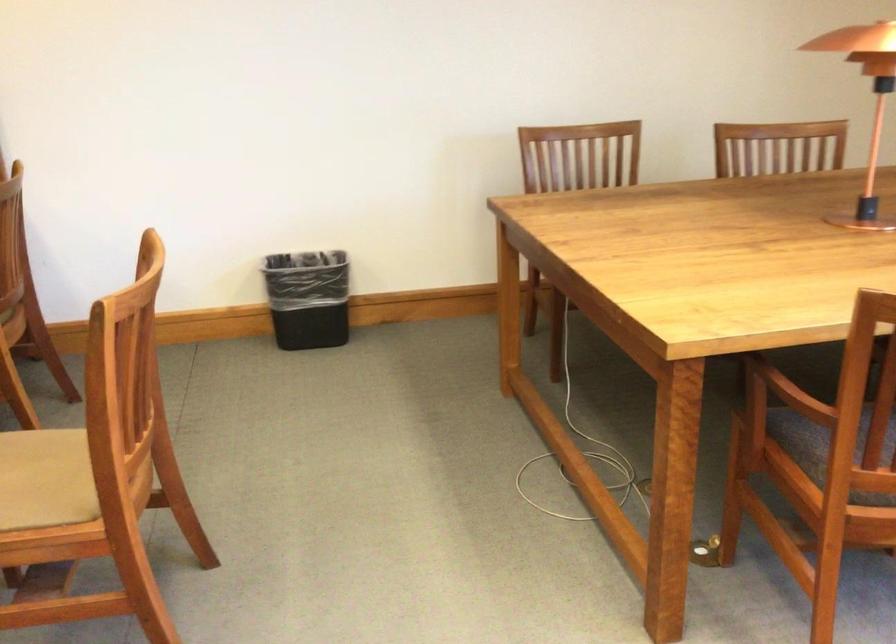
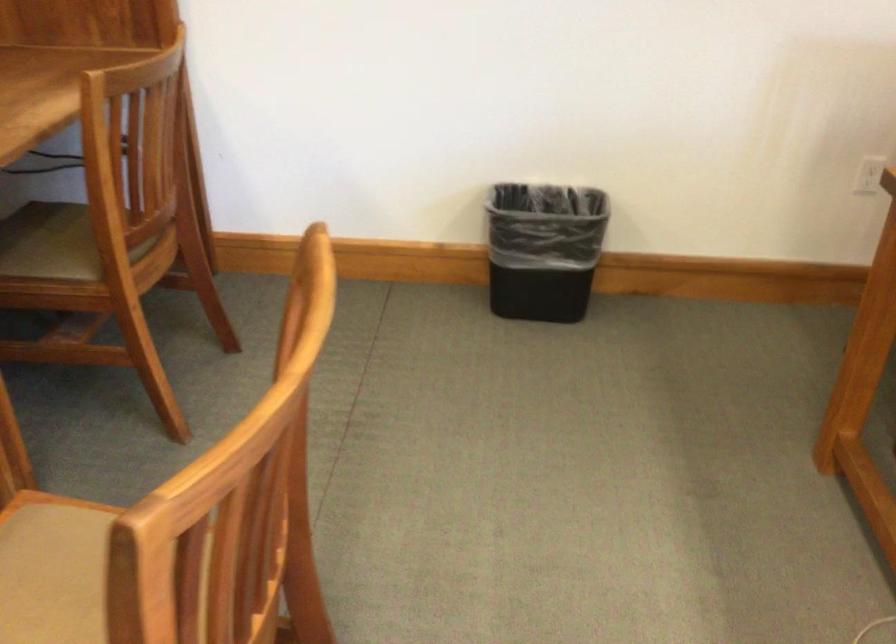
Question: What movement of the cameraman would produce the second image?

Choices:
 (A) Left
 (B) Right
 (C) Forward
 (D) Backward

Answer: (C)